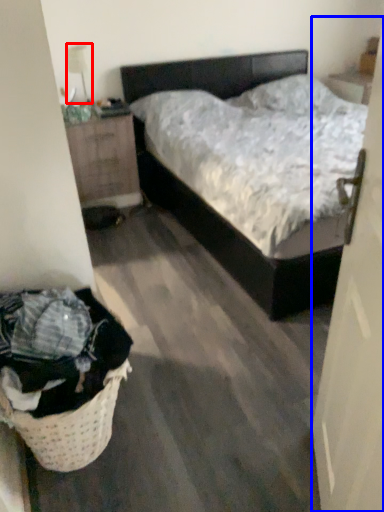
Question: Which of the following is the farthest to the observer, lamp (highlighted by a red box) or door (highlighted by a blue box)?

Choices:
 (A) lamp
 (B) door

Answer: (A)